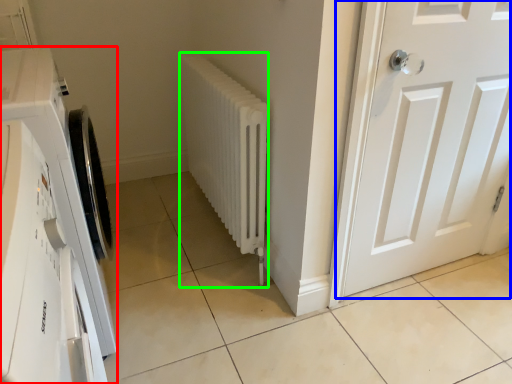
Question: Which object is positioned closest to washing machine (highlighted by a red box)? Select from door (highlighted by a blue box) and radiator (highlighted by a green box).

Choices:
 (A) door
 (B) radiator

Answer: (B)